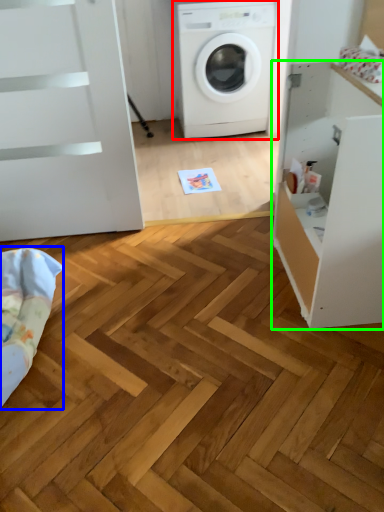
Question: Based on their relative distances, which object is nearer to washing machine (highlighted by a red box)? Choose from bedding (highlighted by a blue box) and file cabinet (highlighted by a green box).

Choices:
 (A) bedding
 (B) file cabinet

Answer: (B)